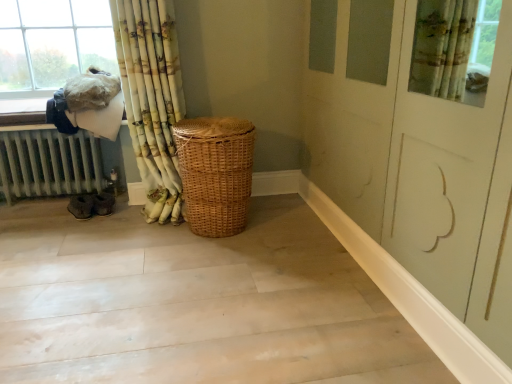
Question: From a real-world perspective, is white painted metal radiator at left above or below bamboo curtain at left?

Choices:
 (A) above
 (B) below

Answer: (B)

Question: Is white painted metal radiator at left in front of or behind bamboo curtain at left in the image?

Choices:
 (A) front
 (B) behind

Answer: (B)

Question: Which of these objects is positioned closest to the bamboo curtain at left?

Choices:
 (A) fuzzy white laundry at upper left
 (B) woven natural basket at center
 (C) white painted metal radiator at left

Answer: (A)

Question: Estimate the real-world distances between objects in this image. Which object is farther from the white painted metal radiator at left?

Choices:
 (A) fuzzy white laundry at upper left
 (B) woven natural basket at center
 (C) bamboo curtain at left

Answer: (B)